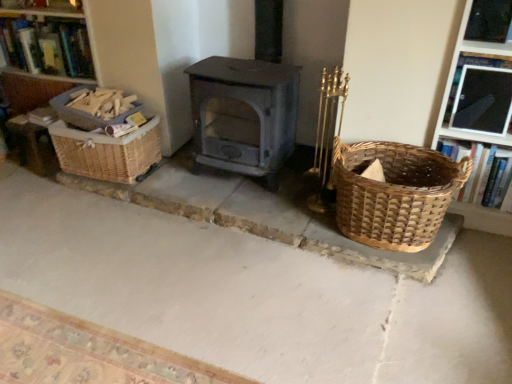
At what (x,y) coordinates should I click in order to perform the action: click on free space to the back side of white woven mat at lower center. Please return your answer as a coordinate pair (x, y). Looking at the image, I should click on (123, 255).